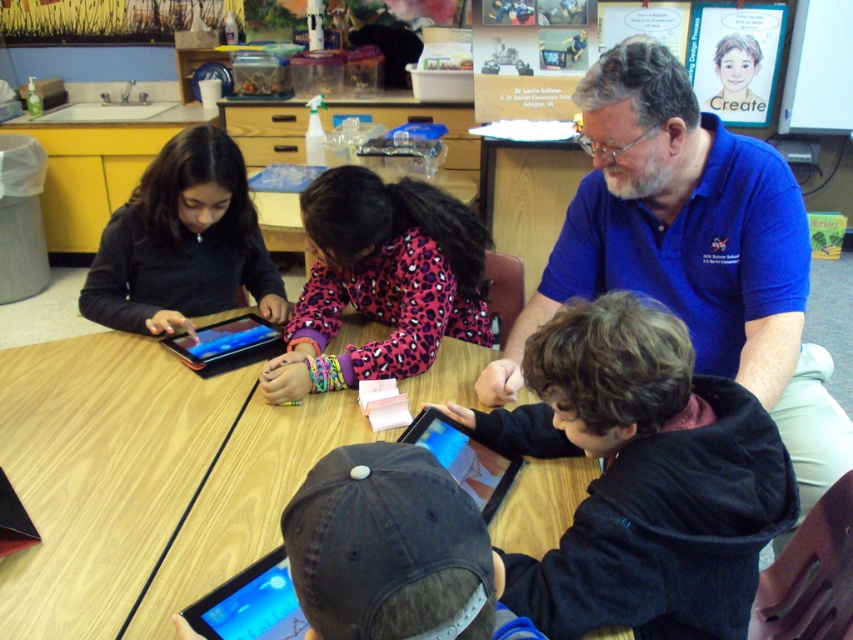
Question: Is dark brown hoodie at center to the left of blue glossy tablet at upper left from the viewer's perspective?

Choices:
 (A) no
 (B) yes

Answer: (A)

Question: Which point is farther from the camera taking this photo?

Choices:
 (A) (233, 262)
 (B) (148, 564)
 (C) (496, 493)

Answer: (A)

Question: Does pink leopard print sweater at center have a smaller size compared to black glossy tablet at lower center?

Choices:
 (A) no
 (B) yes

Answer: (A)

Question: Is dark brown hoodie at center to the left of blue glossy tablet at upper left from the viewer's perspective?

Choices:
 (A) no
 (B) yes

Answer: (A)

Question: Which of the following is the closest to the observer?

Choices:
 (A) pink leopard print sweater at center
 (B) blue glossy tablet at upper left

Answer: (A)

Question: Which point is farther to the camera?

Choices:
 (A) pink leopard print sweater at center
 (B) matte black tablet at lower left
 (C) wooden table at center

Answer: (A)